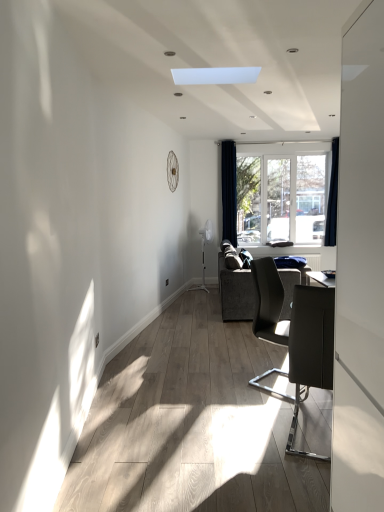
This screenshot has width=384, height=512. Identify the location of vacant space that is to the left of matte black chair at center right, positioned as the first chair in back-to-front order. (228, 383).